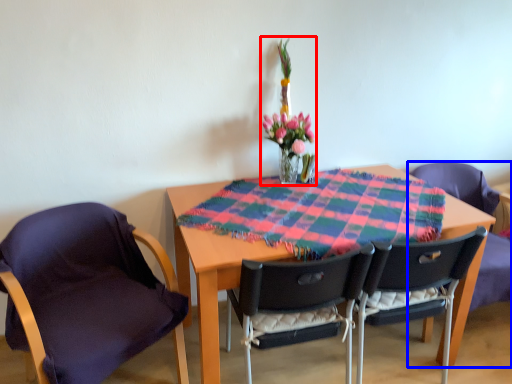
Question: Which of the following is the closest to the observer, floral arrangement (highlighted by a red box) or chair (highlighted by a blue box)?

Choices:
 (A) floral arrangement
 (B) chair

Answer: (A)